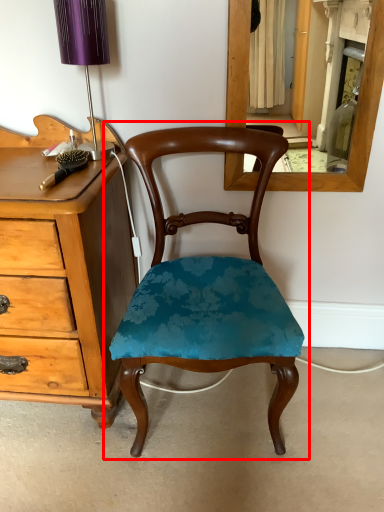
Question: From the image's perspective, what is the correct spatial positioning of chair (annotated by the red box) in reference to table lamp?

Choices:
 (A) above
 (B) below

Answer: (B)